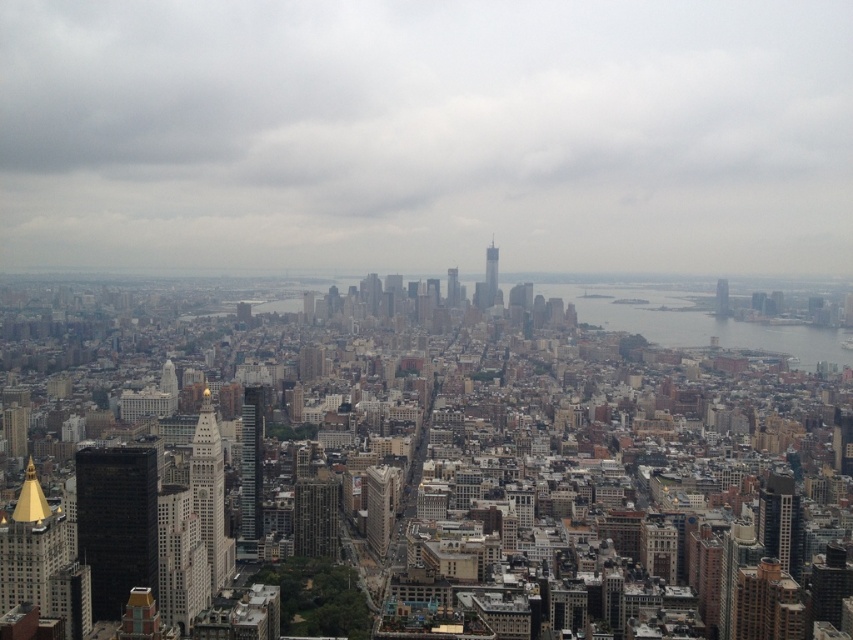
Question: Which object is farther from the camera taking this photo?

Choices:
 (A) gray concrete skyscraper at center
 (B) glassy silver skyscraper at center

Answer: (B)

Question: Is silver metallic skyscraper at center-left below gray concrete skyscraper at center?

Choices:
 (A) no
 (B) yes

Answer: (B)

Question: Can you confirm if silver metallic skyscraper at center-left is positioned to the right of matte glass skyscraper at right?

Choices:
 (A) no
 (B) yes

Answer: (A)

Question: Estimate the real-world distances between objects in this image. Which object is farther from the green glass building at center?

Choices:
 (A) cloudy sky at center
 (B) glassy steel skyscraper at center

Answer: (A)

Question: Is gray concrete skyscraper at center wider than glassy steel skyscraper at center?

Choices:
 (A) no
 (B) yes

Answer: (B)

Question: Which object is closer to the camera taking this photo?

Choices:
 (A) matte glass skyscraper at right
 (B) white marble tower at center
 (C) glassy silver skyscraper at center

Answer: (C)